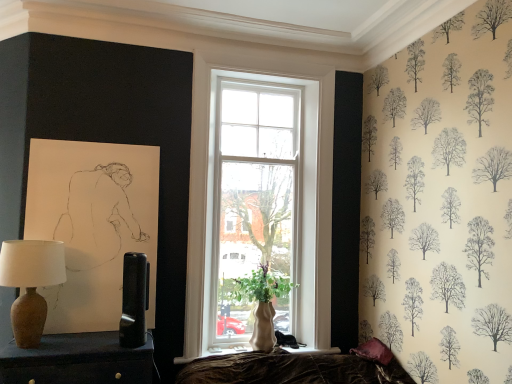
Question: From a real-world perspective, is velvet purple pillow at lower right physically located above or below matte brown lamp at left?

Choices:
 (A) below
 (B) above

Answer: (B)

Question: From the image's perspective, is velvet purple pillow at lower right above or below matte brown lamp at left?

Choices:
 (A) above
 (B) below

Answer: (B)

Question: Which of these objects is positioned farthest from the matte black table lamp at center, the second table lamp from the left?

Choices:
 (A) matte brown vase at left, placed as the second table lamp when sorted from right to left
 (B) velvet purple pillow at lower right
 (C) green matte vase at window
 (D) matte brown lamp at left

Answer: (B)

Question: Estimate the real-world distances between objects in this image. Which object is closer to the green matte vase at window?

Choices:
 (A) matte brown vase at left, arranged as the first table lamp when viewed from the left
 (B) velvet purple pillow at lower right
 (C) matte black table lamp at center, the second table lamp from the left
 (D) matte brown lamp at left

Answer: (B)